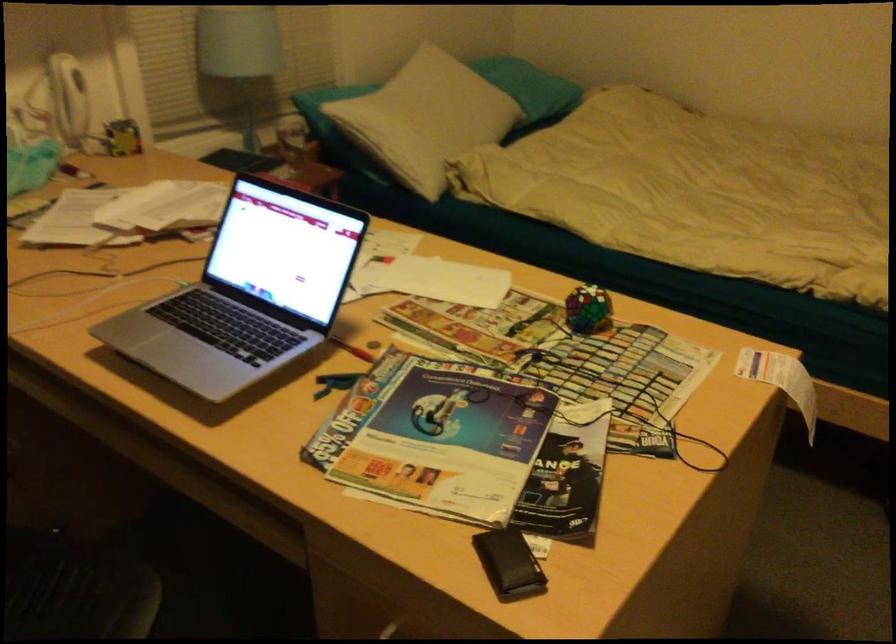
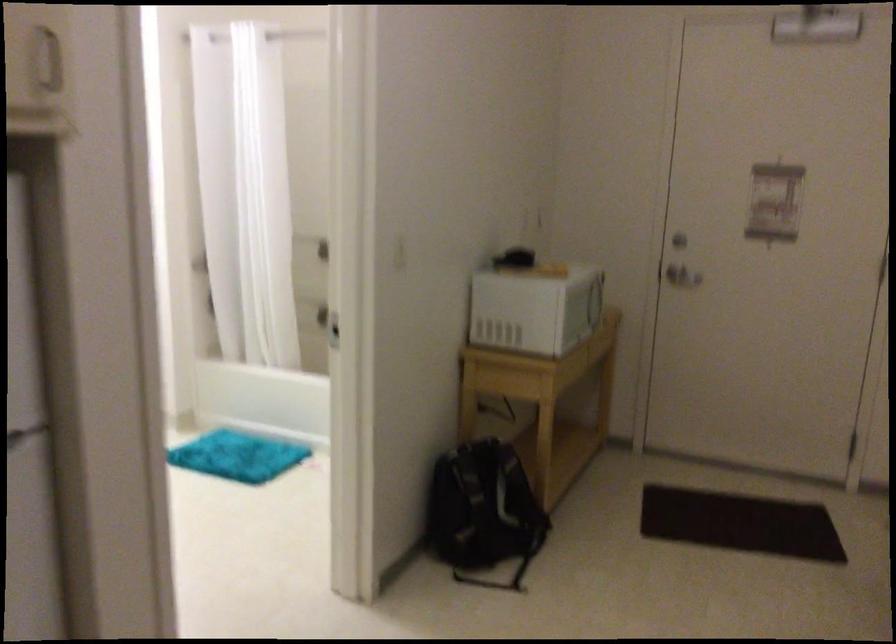
The images are taken continuously from a first-person perspective. In which direction is your viewpoint rotating?

The camera's rotation is toward right-down.